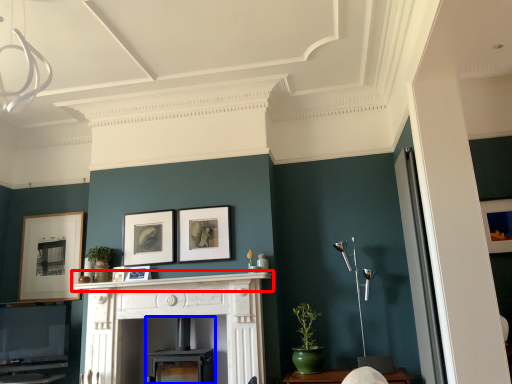
Question: Which object appears farthest to the camera in this image, mantle (highlighted by a red box) or fireplace (highlighted by a blue box)?

Choices:
 (A) mantle
 (B) fireplace

Answer: (B)